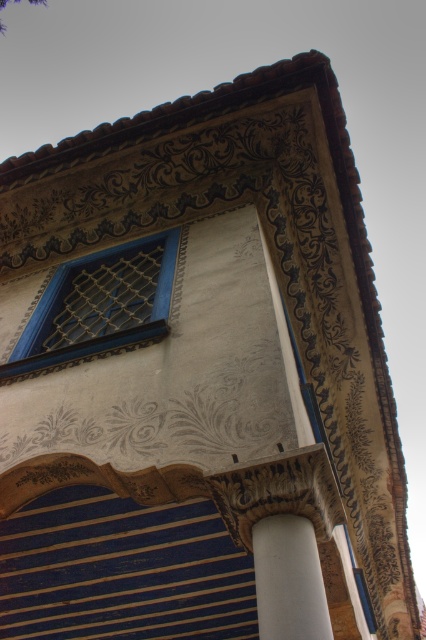
Which of these two, blue painted wood lattice at upper left or white smooth column at lower center, stands shorter?

Standing shorter between the two is white smooth column at lower center.

Does point (126, 284) lie in front of point (287, 532)?

No, it is behind (287, 532).

The height and width of the screenshot is (640, 426). What do you see at coordinates (98, 305) in the screenshot?
I see `blue painted wood lattice at upper left` at bounding box center [98, 305].

Locate an element on the screen. The width and height of the screenshot is (426, 640). blue painted wood lattice at upper left is located at coordinates (98, 305).